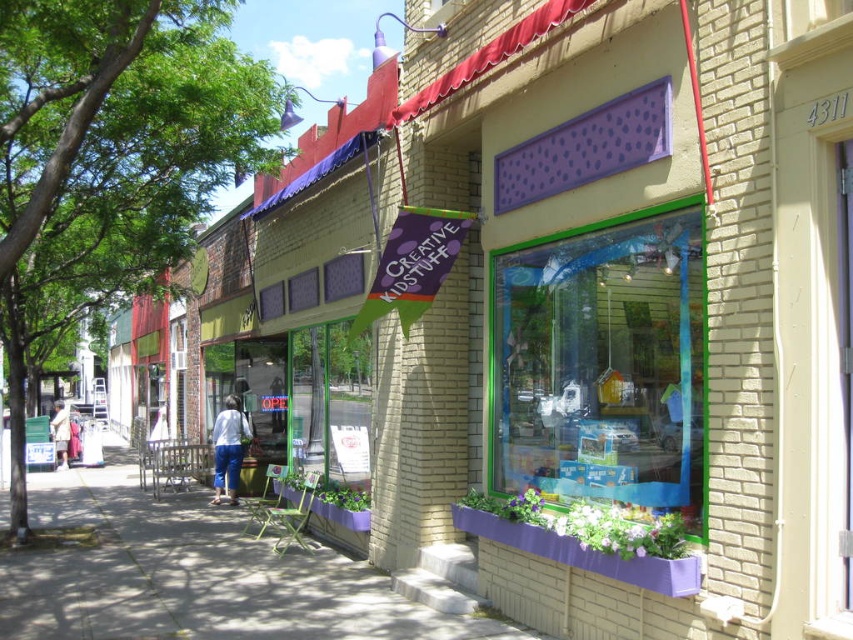
You are a delivery person carrying a heavy box and need to walk from the smooth concrete sidewalk at lower left to the denim pants at center. Is there enough space to move the box through the path between them?

The smooth concrete sidewalk at lower left is wider than the denim pants at center, so there is sufficient space to move the box through the path between them.